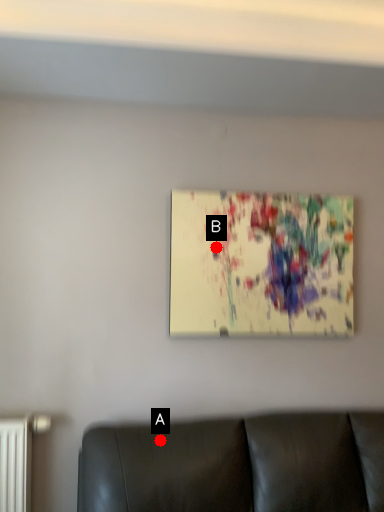
Question: Two points are circled on the image, labeled by A and B beside each circle. Which of the following is the closest to the observer?

Choices:
 (A) A is closer
 (B) B is closer

Answer: (A)